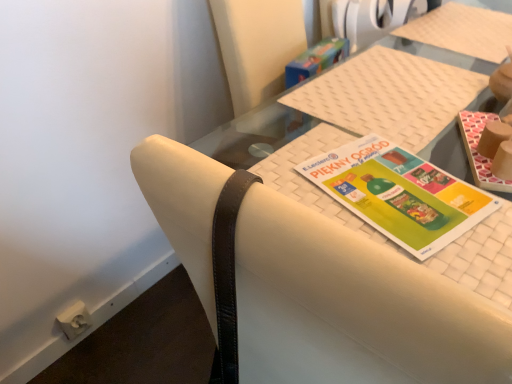
Locate an element on the screen. blank space above white leather chair at center (from a real-world perspective) is located at coordinates (396, 205).